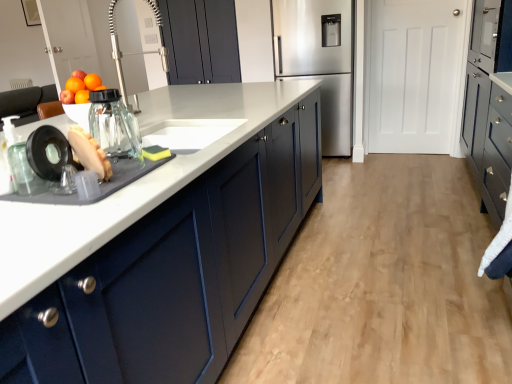
You are a GUI agent. You are given a task and a screenshot of the screen. Output one action in this format:
    pyautogui.click(x=<x>, y=<y>)
    Task: Click on the unoccupied region to the right of brown matte bread at left, which is counted as the 1th food, starting from the front
    
    Given the screenshot: What is the action you would take?
    pyautogui.click(x=151, y=174)